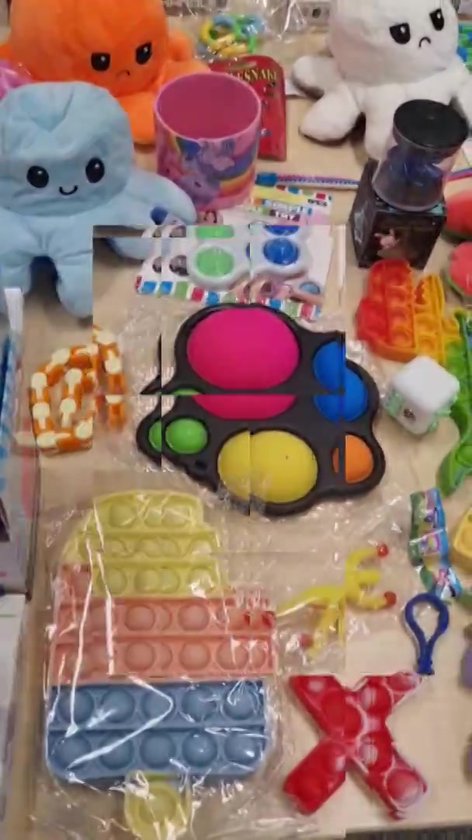
You are a GUI agent. You are given a task and a screenshot of the screen. Output one action in this format:
    pyautogui.click(x=<x>, y=<y>)
    Task: Click on the 1 beige colored surface
    This screenshot has width=472, height=840.
    Given the screenshot: What is the action you would take?
    pyautogui.click(x=442, y=727)